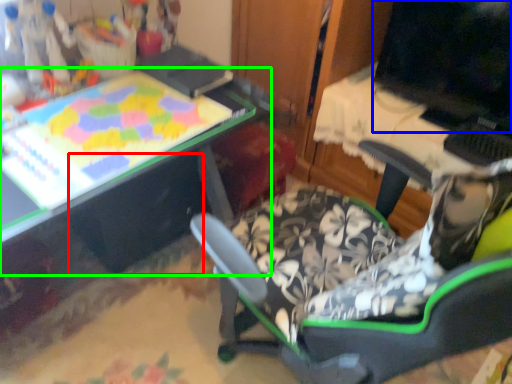
Question: Which is nearer to the drawer (highlighted by a red box)? computer monitor (highlighted by a blue box) or table (highlighted by a green box).

Choices:
 (A) computer monitor
 (B) table

Answer: (B)